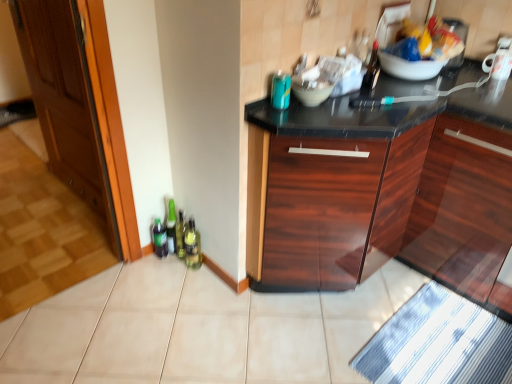
Where is `vacant area that lies between green glass bottle at lower left and blue striped bath mat at lower right`? This screenshot has width=512, height=384. vacant area that lies between green glass bottle at lower left and blue striped bath mat at lower right is located at coordinates (324, 316).